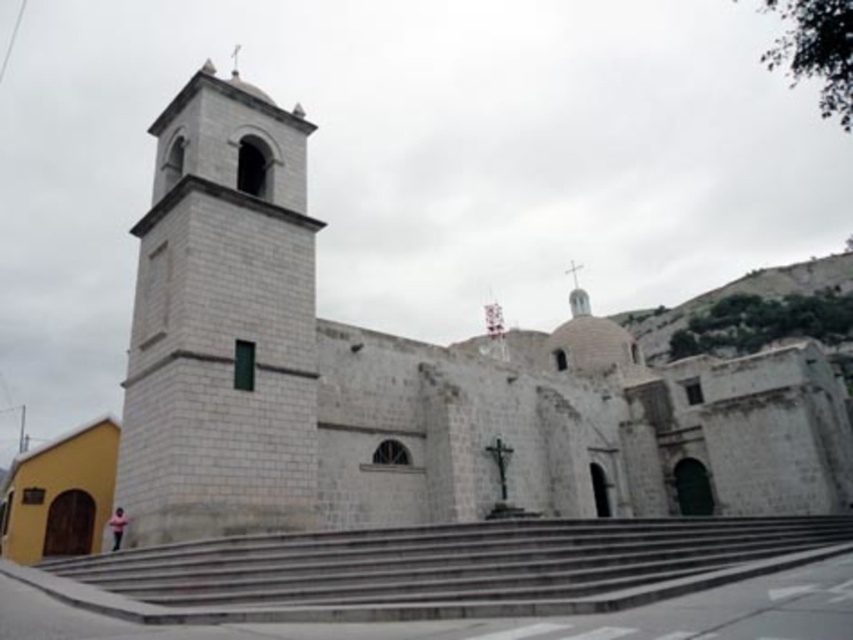
Which is more to the right, white stone bell tower at left or gray concrete stairs at center?

gray concrete stairs at center

Locate an element on the screen. This screenshot has width=853, height=640. white stone bell tower at left is located at coordinates (222, 323).

You are a GUI agent. You are given a task and a screenshot of the screen. Output one action in this format:
    pyautogui.click(x=<x>, y=<y>)
    Task: Click on the white stone bell tower at left
    The height and width of the screenshot is (640, 853).
    Given the screenshot: What is the action you would take?
    pyautogui.click(x=222, y=323)